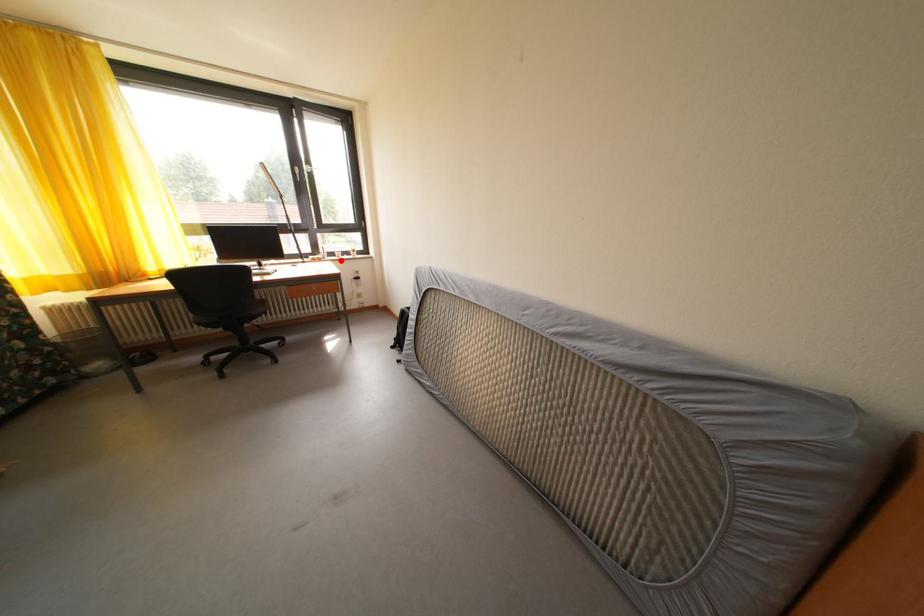
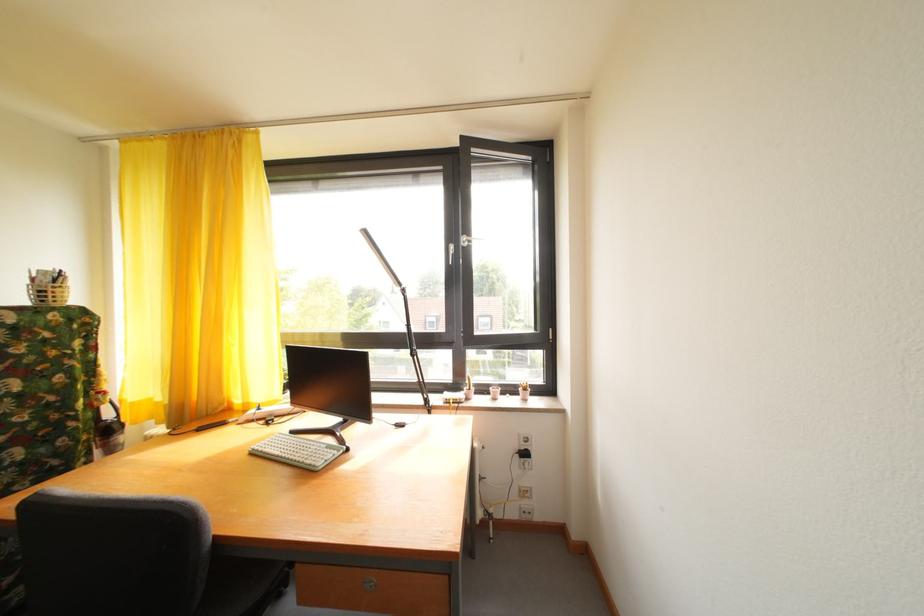
The point at the highlighted location is marked in the first image. Where is the corresponding point in the second image?

(492, 395)